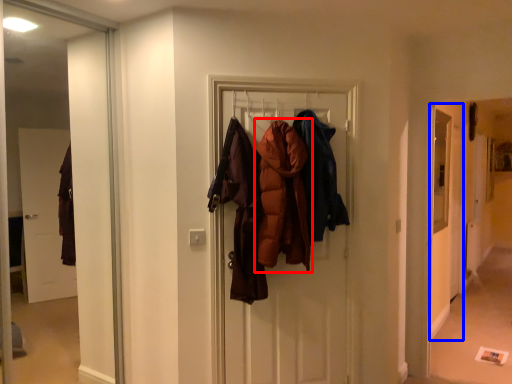
Question: Which object is closer to the camera taking this photo, garment (highlighted by a red box) or screen door (highlighted by a blue box)?

Choices:
 (A) garment
 (B) screen door

Answer: (A)